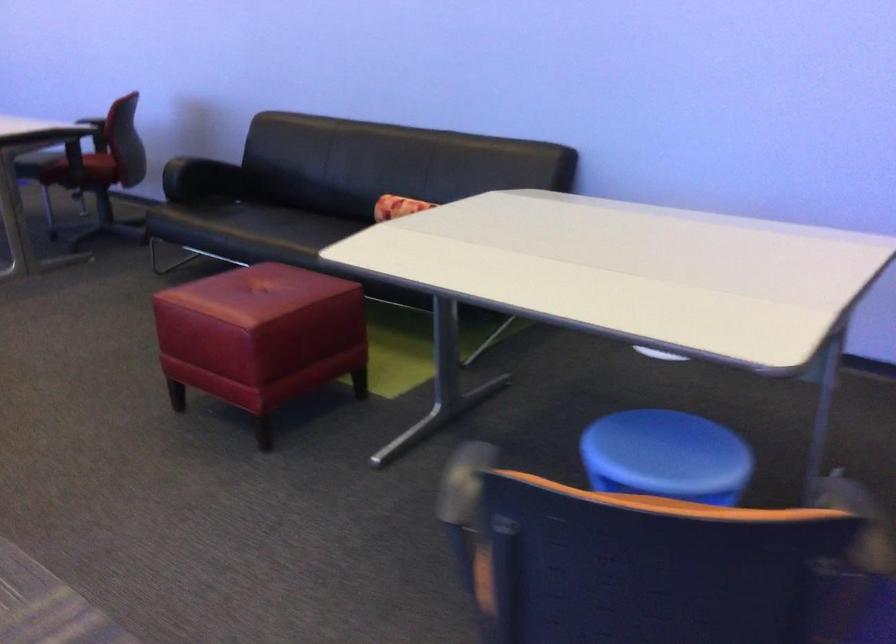
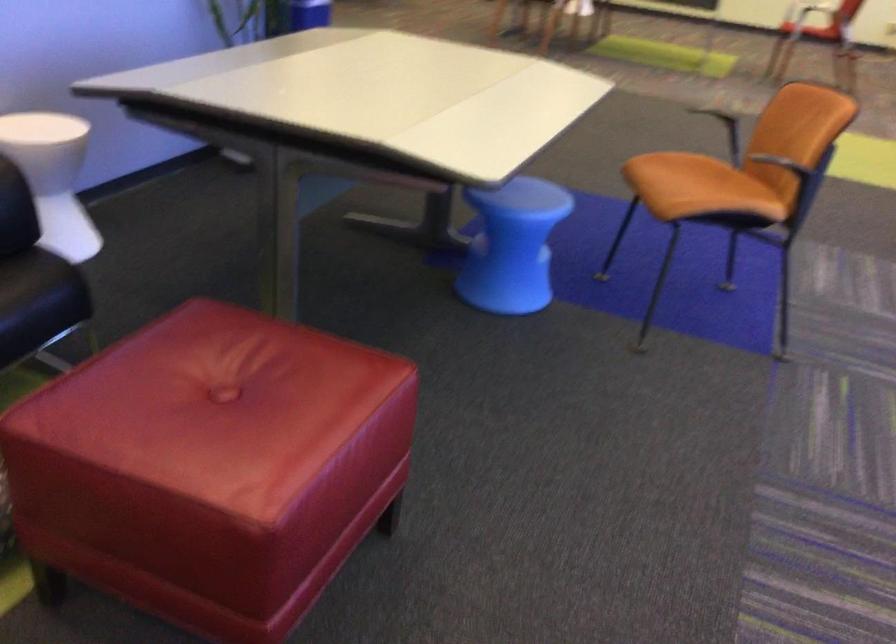
Where in the second image is the point corresponding to (197,287) from the first image?

(211, 466)